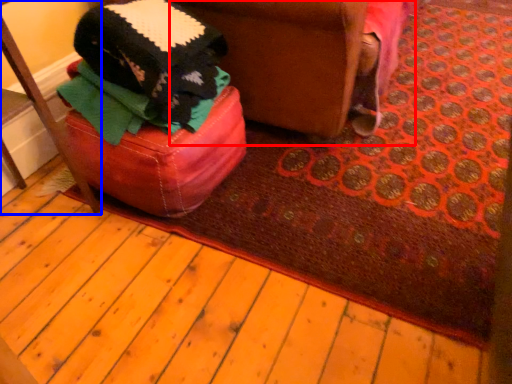
Question: Which object is further to the camera taking this photo, swivel chair (highlighted by a red box) or furniture (highlighted by a blue box)?

Choices:
 (A) swivel chair
 (B) furniture

Answer: (A)